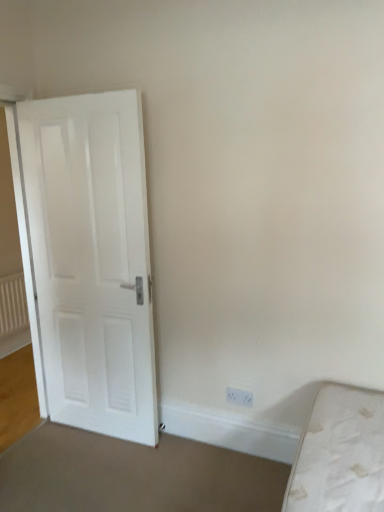
Question: Is white textured radiator at left outside white plastic electric outlet at lower right?

Choices:
 (A) yes
 (B) no

Answer: (A)

Question: From a real-world perspective, is white textured radiator at left under white plastic electric outlet at lower right?

Choices:
 (A) yes
 (B) no

Answer: (B)

Question: Can you confirm if white textured radiator at left is wider than white plastic electric outlet at lower right?

Choices:
 (A) yes
 (B) no

Answer: (A)

Question: From the image's perspective, is white textured radiator at left located above white plastic electric outlet at lower right?

Choices:
 (A) no
 (B) yes

Answer: (B)

Question: Considering the relative positions of white textured radiator at left and white plastic electric outlet at lower right in the image provided, is white textured radiator at left to the left of white plastic electric outlet at lower right from the viewer's perspective?

Choices:
 (A) no
 (B) yes

Answer: (B)

Question: From the image's perspective, is white textured radiator at left located beneath white plastic electric outlet at lower right?

Choices:
 (A) no
 (B) yes

Answer: (A)

Question: Is white textured radiator at left further to camera compared to white matte door at left?

Choices:
 (A) no
 (B) yes

Answer: (B)

Question: Can you confirm if white textured radiator at left is bigger than white matte door at left?

Choices:
 (A) yes
 (B) no

Answer: (B)

Question: Does white textured radiator at left have a greater height compared to white matte door at left?

Choices:
 (A) no
 (B) yes

Answer: (A)

Question: Is white textured radiator at left oriented towards white matte door at left?

Choices:
 (A) yes
 (B) no

Answer: (B)

Question: Are white textured radiator at left and white matte door at left far apart?

Choices:
 (A) yes
 (B) no

Answer: (A)

Question: Is white matte door at left completely or partially inside white textured radiator at left?

Choices:
 (A) yes
 (B) no

Answer: (B)

Question: Is white plastic electric outlet at lower right surrounding white textured radiator at left?

Choices:
 (A) no
 (B) yes

Answer: (A)